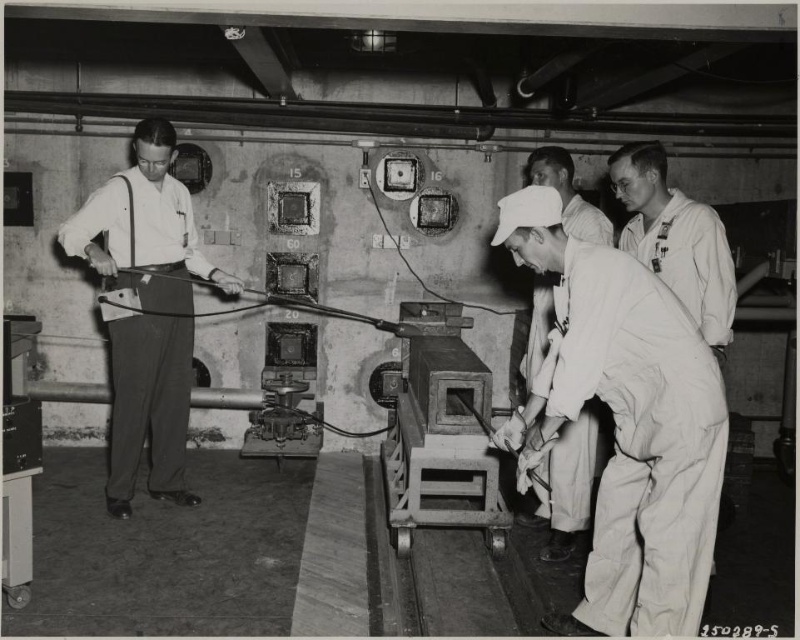
You are a safety inspector in this lab and need to check the equipment. There are two workers in white cotton overalls at center and white cotton shirt at center. Which worker is positioned to the left when facing the equipment?

The white cotton overalls at center is to the left of white cotton shirt at center.

You are a safety inspector in the lab. You observe two workers wearing the white fabric uniform at center and the white cotton shirt at center. Which clothing item is covering the other?

The white fabric uniform at center is positioned over the white cotton shirt at center, so the uniform is covering the shirt.

You are standing at the origin point in the lab. Where is the white matte shirt at left located in terms of coordinates?

The white matte shirt at left is located at coordinates point (146, 308).